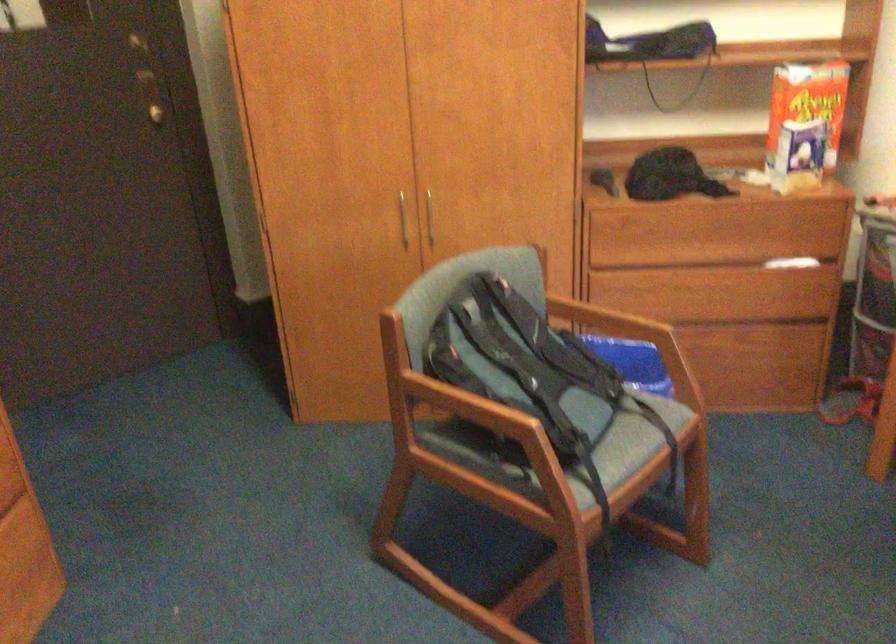
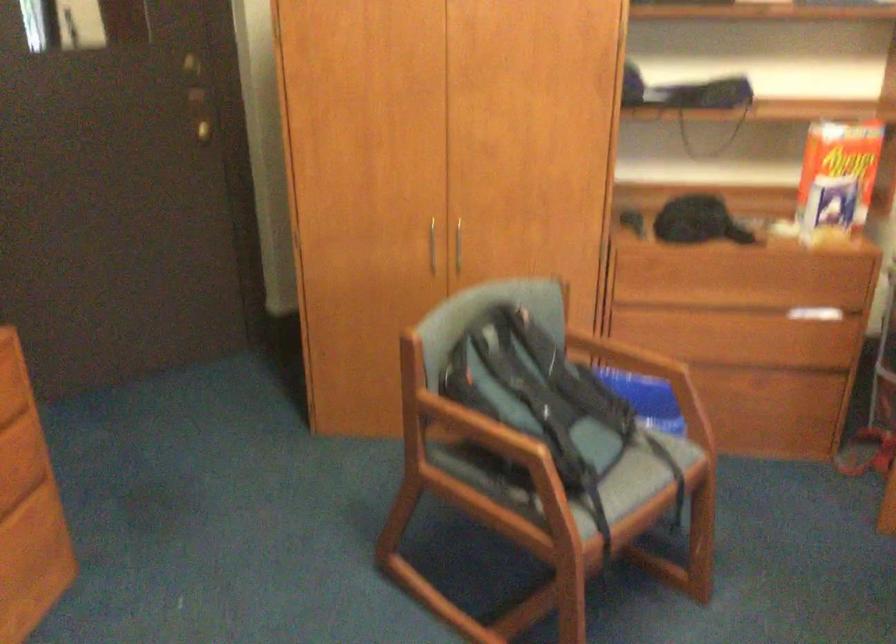
Question: How did the camera likely rotate?

Choices:
 (A) Left
 (B) Right
 (C) Up
 (D) Down

Answer: (A)